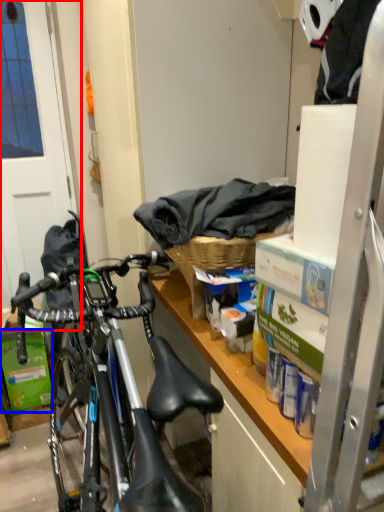
Question: Which of the following is the farthest to the observer, screen door (highlighted by a red box) or box (highlighted by a blue box)?

Choices:
 (A) screen door
 (B) box

Answer: (B)